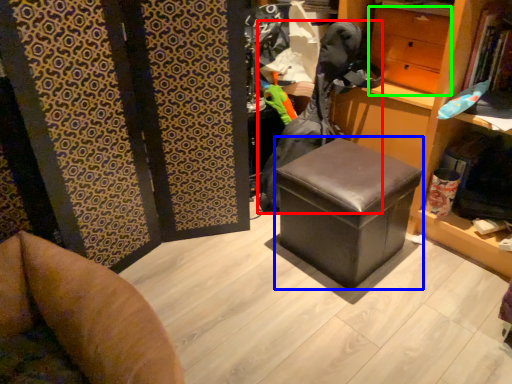
Question: Considering the real-world distances, which object is farthest from clothing (highlighted by a red box)? stool (highlighted by a blue box) or drawer (highlighted by a green box)?

Choices:
 (A) stool
 (B) drawer

Answer: (A)